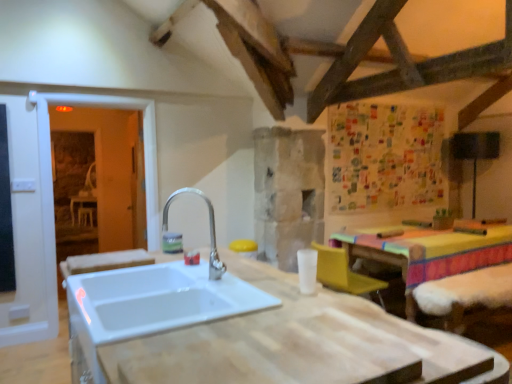
Locate an element on the screen. Image resolution: width=512 pixels, height=384 pixels. white ceramic sink at center is located at coordinates (162, 295).

Locate an element on the screen. This screenshot has height=384, width=512. transparent glass door at left is located at coordinates (144, 142).

Is yellow plastic armchair at lower right located within transparent glass door at left?

Actually, yellow plastic armchair at lower right is outside transparent glass door at left.

Between transparent glass door at left and yellow plastic armchair at lower right, which one has less height?

Standing shorter between the two is yellow plastic armchair at lower right.

Between transparent glass door at left and yellow plastic armchair at lower right, which one appears on the right side from the viewer's perspective?

Positioned to the right is yellow plastic armchair at lower right.

From a real-world perspective, is transparent glass door at left on top of yellow plastic armchair at lower right?

Yes.

From a real-world perspective, is white ceramic sink at center over white wood countertop at center?

Yes, from a real-world perspective, white ceramic sink at center is over white wood countertop at center

Is white ceramic sink at center smaller than white wood countertop at center?

Correct, white ceramic sink at center occupies less space than white wood countertop at center.

Considering the positions of objects white ceramic sink at center and white wood countertop at center in the image provided, who is more to the right, white ceramic sink at center or white wood countertop at center?

white wood countertop at center is more to the right.

Which of these two, white ceramic sink at center or white wood countertop at center, stands shorter?

With less height is white ceramic sink at center.

How many degrees apart are the facing directions of yellow plastic armchair at lower right and transparent glass door at left?

The angular difference between yellow plastic armchair at lower right and transparent glass door at left is 88.8 degrees.

Does yellow plastic armchair at lower right have a larger size compared to transparent glass door at left?

Incorrect, yellow plastic armchair at lower right is not larger than transparent glass door at left.

Can you confirm if yellow plastic armchair at lower right is wider than transparent glass door at left?

Yes, yellow plastic armchair at lower right is wider than transparent glass door at left.

Where is `armchair below the transparent glass door at left (from the image's perspective)`? armchair below the transparent glass door at left (from the image's perspective) is located at coordinates (344, 273).

Is yellow plastic armchair at lower right to the right of white wood countertop at center from the viewer's perspective?

Yes.

Considering the positions of objects yellow plastic armchair at lower right and white wood countertop at center in the image provided, who is behind, yellow plastic armchair at lower right or white wood countertop at center?

yellow plastic armchair at lower right is further from the camera.

Based on the photo, in terms of size, does yellow plastic armchair at lower right appear bigger or smaller than white wood countertop at center?

Clearly, yellow plastic armchair at lower right is smaller in size than white wood countertop at center.

Considering the positions of point (321, 271) and point (356, 330), is point (321, 271) closer or farther from the camera than point (356, 330)?

Point (321, 271) is positioned farther from the camera compared to point (356, 330).

Do you think white ceramic sink at center is within yellow plastic armchair at lower right, or outside of it?

white ceramic sink at center is spatially situated outside yellow plastic armchair at lower right.

Which point is more distant from viewer, [182,297] or [341,250]?

The point [341,250] is farther from the camera.

Is white ceramic sink at center beside yellow plastic armchair at lower right?

No, white ceramic sink at center is not making contact with yellow plastic armchair at lower right.

Locate an element on the screen. armchair lying behind the white ceramic sink at center is located at coordinates (344, 273).

Is yellow plastic armchair at lower right in contact with white ceramic sink at center?

yellow plastic armchair at lower right is not next to white ceramic sink at center, and they're not touching.

Between yellow plastic armchair at lower right and white ceramic sink at center, which one has smaller size?

yellow plastic armchair at lower right.

Is yellow plastic armchair at lower right oriented towards white ceramic sink at center?

No, yellow plastic armchair at lower right is not facing towards white ceramic sink at center.

Visually, is transparent glass door at left positioned to the left or to the right of white wood countertop at center?

In the image, transparent glass door at left appears on the left side of white wood countertop at center.

Does transparent glass door at left turn towards white wood countertop at center?

Yes, transparent glass door at left is turned towards white wood countertop at center.

From the image's perspective, does transparent glass door at left appear higher than white wood countertop at center?

Yes.

Would you consider transparent glass door at left to be distant from white wood countertop at center?

Yes.

At what (x,y) coordinates should I click in order to perform the action: click on glass door behind the yellow plastic armchair at lower right. Please return your answer as a coordinate pair (x, y). Image resolution: width=512 pixels, height=384 pixels. Looking at the image, I should click on (144, 142).

At what (x,y) coordinates should I click in order to perform the action: click on sink above the white wood countertop at center (from a real-world perspective). Please return your answer as a coordinate pair (x, y). Image resolution: width=512 pixels, height=384 pixels. Looking at the image, I should click on (162, 295).

Estimate the real-world distances between objects in this image. Which object is closer to white wood countertop at center, transparent glass door at left or yellow plastic armchair at lower right?

yellow plastic armchair at lower right is positioned closer to the anchor white wood countertop at center.

From the picture: Which object lies further to the anchor point yellow plastic armchair at lower right, white wood countertop at center or white ceramic sink at center?

Among the two, white wood countertop at center is located further to yellow plastic armchair at lower right.

Based on their spatial positions, is white wood countertop at center or yellow plastic armchair at lower right closer to transparent glass door at left?

Based on the image, yellow plastic armchair at lower right appears to be nearer to transparent glass door at left.

When comparing their distances from white wood countertop at center, does white ceramic sink at center or yellow plastic armchair at lower right seem closer?

white ceramic sink at center.

Estimate the real-world distances between objects in this image. Which object is further from white ceramic sink at center, transparent glass door at left or white wood countertop at center?

The object further to white ceramic sink at center is transparent glass door at left.

Which object lies further to the anchor point white ceramic sink at center, yellow plastic armchair at lower right or transparent glass door at left?

Among the two, transparent glass door at left is located further to white ceramic sink at center.

Based on their spatial positions, is transparent glass door at left or white ceramic sink at center further from yellow plastic armchair at lower right?

transparent glass door at left is further to yellow plastic armchair at lower right.

Based on their spatial positions, is white ceramic sink at center or transparent glass door at left further from yellow plastic armchair at lower right?

The object further to yellow plastic armchair at lower right is transparent glass door at left.

You are a GUI agent. You are given a task and a screenshot of the screen. Output one action in this format:
    pyautogui.click(x=<x>, y=<y>)
    Task: Click on the armchair between white ceramic sink at center and transparent glass door at left from front to back
    Image resolution: width=512 pixels, height=384 pixels.
    Given the screenshot: What is the action you would take?
    pyautogui.click(x=344, y=273)

In order to click on sink between white wood countertop at center and transparent glass door at left in the front-back direction in this screenshot , I will do `click(162, 295)`.

You are a GUI agent. You are given a task and a screenshot of the screen. Output one action in this format:
    pyautogui.click(x=<x>, y=<y>)
    Task: Click on the armchair between white wood countertop at center and transparent glass door at left in the front-back direction
    The image size is (512, 384).
    Given the screenshot: What is the action you would take?
    pyautogui.click(x=344, y=273)

Identify the location of sink between white wood countertop at center and yellow plastic armchair at lower right from front to back. (162, 295).